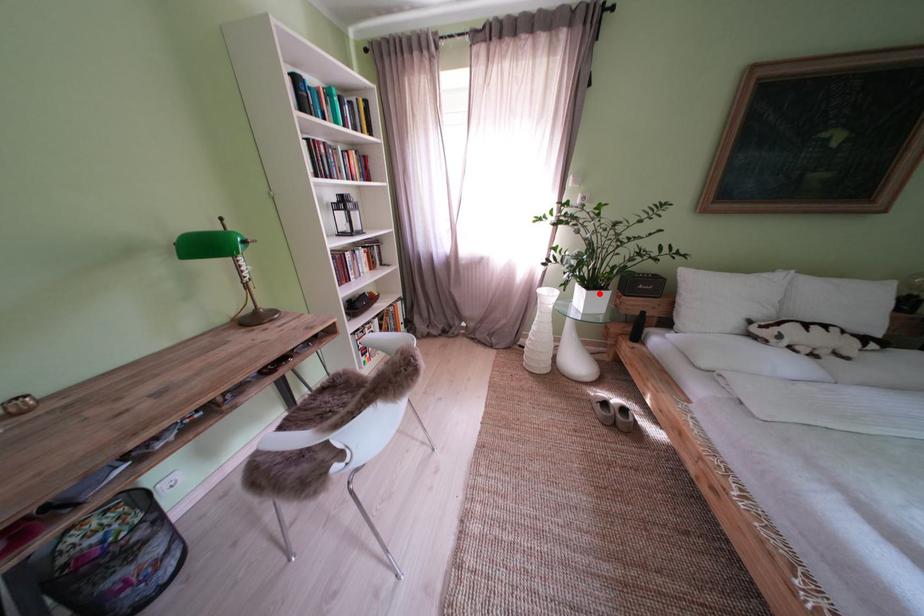
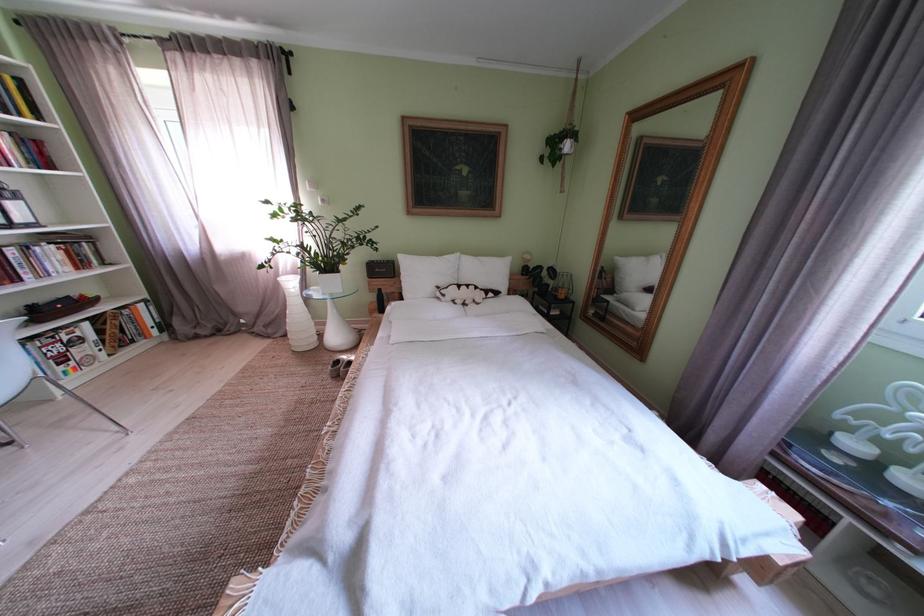
Find the pixel in the second image that matches the highlighted location in the first image.

(333, 278)